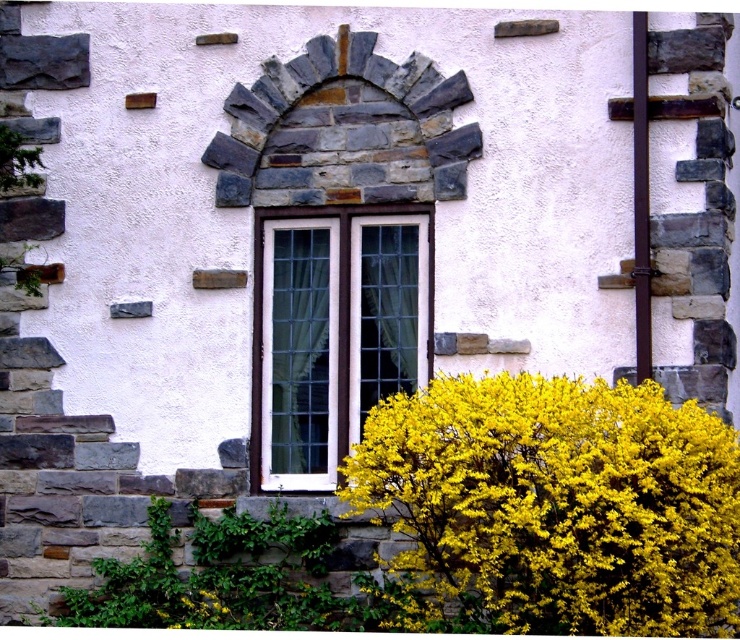
Who is more forward, [423,472] or [260,372]?

Point [423,472]

Where is `yellow fluffy bush at lower right`? The width and height of the screenshot is (740, 640). yellow fluffy bush at lower right is located at coordinates (554, 506).